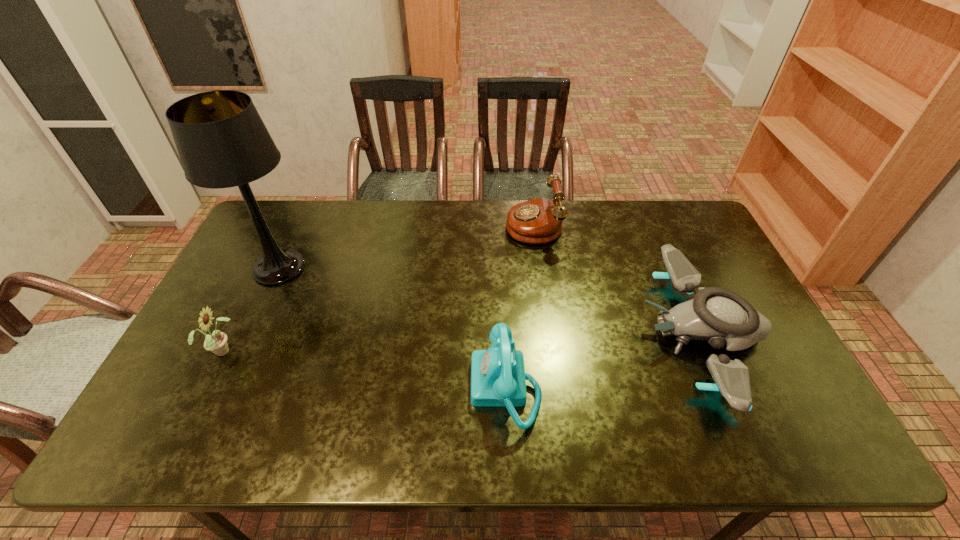
I want to click on the tallest object, so click(x=222, y=142).

Locate an element on the screen. Image resolution: width=960 pixels, height=540 pixels. the taller telephone is located at coordinates (537, 221).

You are a GUI agent. You are given a task and a screenshot of the screen. Output one action in this format:
    pyautogui.click(x=<x>, y=<y>)
    Task: Click on the sunflower
    This screenshot has height=540, width=960.
    Given the screenshot: What is the action you would take?
    pyautogui.click(x=216, y=342)

This screenshot has width=960, height=540. Identify the location of the second shortest object. coord(498,379).

Where is `the shorter telephone`? The width and height of the screenshot is (960, 540). the shorter telephone is located at coordinates (498, 379).

Identify the location of drone. This screenshot has width=960, height=540. (719, 316).

Locate an element on the screen. the rightmost object is located at coordinates (719, 316).

Image resolution: width=960 pixels, height=540 pixels. I want to click on free location located 0.180m on the back of the table lamp, so click(305, 212).

The width and height of the screenshot is (960, 540). What are the coordinates of `vacant region located on the dial of the farther telephone` in the screenshot? It's located at (426, 223).

Identify the location of vacant space situated on the dial of the farther telephone. The width and height of the screenshot is (960, 540). (412, 223).